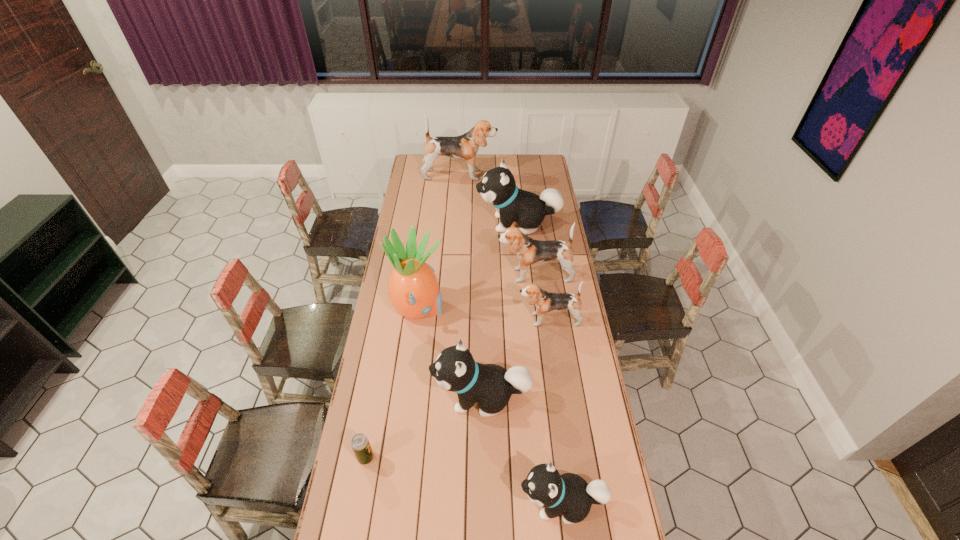
I want to click on free space between the second nearest object and the orange pineapple, so click(x=393, y=383).

At what (x,y) coordinates should I click in order to perform the action: click on empty location between the nearest brown puppy and the orange pineapple. Please return your answer as a coordinate pair (x, y). The width and height of the screenshot is (960, 540). Looking at the image, I should click on (484, 315).

This screenshot has height=540, width=960. What are the coordinates of `free spot between the third farthest puppy and the nearest white puppy` in the screenshot? It's located at (548, 389).

At what (x,y) coordinates should I click in order to perform the action: click on free space between the nearest puppy and the second biggest white puppy. Please return your answer as a coordinate pair (x, y). This screenshot has width=960, height=540. Looking at the image, I should click on (521, 450).

The image size is (960, 540). Find the location of `free point between the pineapple and the fourth farthest puppy`. free point between the pineapple and the fourth farthest puppy is located at coordinates (484, 315).

Identify which object is the third closest to the smallest brown puppy. Please provide its 2D coordinates. Your answer should be formatted as a tuple, i.e. [(x, y)], where the tuple contains the x and y coordinates of a point satisfying the conditions above.

[(413, 290)]

The image size is (960, 540). Find the location of `object that can be found as the third closest to the nearest brown puppy`. object that can be found as the third closest to the nearest brown puppy is located at coordinates (413, 290).

Identify which puppy is the second nearest to the beer can. Please provide its 2D coordinates. Your answer should be formatted as a tuple, i.e. [(x, y)], where the tuple contains the x and y coordinates of a point satisfying the conditions above.

[(569, 493)]

Locate which puppy ranks fourth in proximity to the second nearest object. Please provide its 2D coordinates. Your answer should be formatted as a tuple, i.e. [(x, y)], where the tuple contains the x and y coordinates of a point satisfying the conditions above.

[(529, 251)]

The image size is (960, 540). I want to click on brown puppy that can be found as the closest to the nearest brown puppy, so click(x=529, y=251).